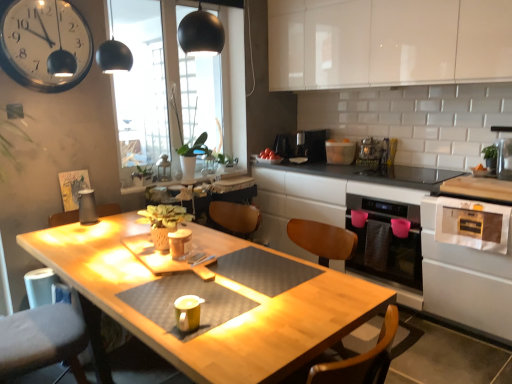
Describe the element at coordinates (503, 152) in the screenshot. I see `clear glass vase at upper right, the 4th appliance viewed from the front` at that location.

What do you see at coordinates (466, 280) in the screenshot? The height and width of the screenshot is (384, 512). I see `white glossy oven at lower right, the 1th oven in the front-to-back sequence` at bounding box center [466, 280].

Locate an element on the screen. This screenshot has height=384, width=512. matte plastic container at center, which is the 7th appliance in right-to-left order is located at coordinates (180, 243).

From the image's perspective, which is above, gray fabric swivel chair at lower left or white glossy countertop at center?

white glossy countertop at center appears higher in the image.

Does point (77, 360) lie in front of point (415, 303)?

Yes.

Is gray fabric swivel chair at lower left far away from white glossy countertop at center?

gray fabric swivel chair at lower left is positioned a significant distance from white glossy countertop at center.

Considering the sizes of gray fabric swivel chair at lower left and white glossy countertop at center in the image, is gray fabric swivel chair at lower left taller or shorter than white glossy countertop at center?

In the image, gray fabric swivel chair at lower left appears to be shorter than white glossy countertop at center.

Can you tell me how much white glossy clock at upper left and black glossy oven at lower right, arranged as the 2th oven when viewed from the front, differ in facing direction?

91.8 degrees separate the facing orientations of white glossy clock at upper left and black glossy oven at lower right, arranged as the 2th oven when viewed from the front.

Which is in front, white glossy clock at upper left or black glossy oven at lower right, arranged as the 2th oven when viewed from the front?

Positioned in front is white glossy clock at upper left.

From the image's perspective, is white glossy clock at upper left located above or below black glossy oven at lower right, arranged as the 2th oven when viewed from the front?

From the image's perspective, white glossy clock at upper left appears above black glossy oven at lower right, arranged as the 2th oven when viewed from the front.

Could you tell me if white glossy clock at upper left is facing black glossy oven at lower right, arranged as the 2th oven when viewed from the front?

No, white glossy clock at upper left does not turn towards black glossy oven at lower right, arranged as the 2th oven when viewed from the front.

Is white glossy clock at upper left placed right next to matte yellow cup at center, the eighth appliance positioned from the back?

No, white glossy clock at upper left is not with matte yellow cup at center, the eighth appliance positioned from the back.

Is white glossy clock at upper left thinner than matte yellow cup at center, the eighth appliance positioned from the back?

Correct, the width of white glossy clock at upper left is less than that of matte yellow cup at center, the eighth appliance positioned from the back.

Considering the sizes of white glossy clock at upper left and matte yellow cup at center, placed as the first appliance when sorted from front to back, in the image, is white glossy clock at upper left bigger or smaller than matte yellow cup at center, placed as the first appliance when sorted from front to back,?

In the image, white glossy clock at upper left appears to be larger than matte yellow cup at center, placed as the first appliance when sorted from front to back.

Is white glossy oven at lower right, placed as the 2th oven when sorted from back to front, turned away from white glossy clock at upper left?

That's not correct — white glossy oven at lower right, placed as the 2th oven when sorted from back to front, is not looking away from white glossy clock at upper left.

Looking at this image, can you tell me how much white glossy oven at lower right, placed as the 2th oven when sorted from back to front, and white glossy clock at upper left differ in facing direction?

The angular difference between white glossy oven at lower right, placed as the 2th oven when sorted from back to front, and white glossy clock at upper left is 91.8 degrees.

Which is correct: white glossy oven at lower right, placed as the 2th oven when sorted from back to front, is inside white glossy clock at upper left, or outside of it?

white glossy oven at lower right, placed as the 2th oven when sorted from back to front, is not inside white glossy clock at upper left, it's outside.

From a real-world perspective, is white glossy oven at lower right, placed as the 2th oven when sorted from back to front, on top of white glossy clock at upper left?

Incorrect, from a real-world perspective, white glossy oven at lower right, placed as the 2th oven when sorted from back to front, is lower than white glossy clock at upper left.

Who is shorter, white glossy cabinet at upper center or black glossy oven at lower right, which is the first oven from back to front?

black glossy oven at lower right, which is the first oven from back to front.

Which is behind, point (474, 46) or point (354, 230)?

The point (354, 230) is farther.

Is black glossy oven at lower right, arranged as the 2th oven when viewed from the front, a part of white glossy cabinet at upper center?

No.

Is white glossy cabinet at upper center directly adjacent to black glossy oven at lower right, which is the first oven from back to front?

white glossy cabinet at upper center and black glossy oven at lower right, which is the first oven from back to front, are clearly separated.

From a real-world perspective, relative to white glossy clock at upper left, is gray fabric swivel chair at lower left vertically above or below?

Clearly, from a real-world perspective, gray fabric swivel chair at lower left is below white glossy clock at upper left.

Is gray fabric swivel chair at lower left next to white glossy clock at upper left and touching it?

No, gray fabric swivel chair at lower left is not with white glossy clock at upper left.

Considering the relative sizes of gray fabric swivel chair at lower left and white glossy clock at upper left in the image provided, is gray fabric swivel chair at lower left thinner than white glossy clock at upper left?

In fact, gray fabric swivel chair at lower left might be wider than white glossy clock at upper left.

Does gray fabric swivel chair at lower left turn towards white glossy clock at upper left?

No, gray fabric swivel chair at lower left does not turn towards white glossy clock at upper left.

How different are the orientations of clear glass vase at upper right, which is the 1th appliance in right-to-left order, and green matte plant at center in degrees?

The angle between the facing direction of clear glass vase at upper right, which is the 1th appliance in right-to-left order, and the facing direction of green matte plant at center is 94.3 degrees.

From the image's perspective, between clear glass vase at upper right, the 4th appliance viewed from the front, and green matte plant at center, who is located below?

clear glass vase at upper right, the 4th appliance viewed from the front.

Between point (500, 129) and point (195, 157), which one is positioned behind?

The point (195, 157) is farther from the camera.

This screenshot has width=512, height=384. Find the location of `swivel chair on the left of white glossy countertop at center`. swivel chair on the left of white glossy countertop at center is located at coordinates (42, 340).

Find the location of a particular element. This screenshot has width=512, height=384. the 1st oven to the right when counting from the white glossy clock at upper left is located at coordinates (387, 247).

Estimate the real-world distances between objects in this image. Which object is closer to matte yellow cup at center, which ranks as the 3th appliance in left-to-right order, transparent glass window at upper center or white glossy clock at upper left?

white glossy clock at upper left is positioned closer to the anchor matte yellow cup at center, which ranks as the 3th appliance in left-to-right order.

When comparing their distances from gray fabric swivel chair at lower left, does white glossy countertop at center or white glossy cabinet at upper center seem closer?

The object closer to gray fabric swivel chair at lower left is white glossy countertop at center.

When comparing their distances from gray fabric swivel chair at lower left, does white glossy toaster at upper center, arranged as the sixth appliance when viewed from the front, or black plastic coffee maker at center, which is the 1th appliance from back to front, seem closer?

black plastic coffee maker at center, which is the 1th appliance from back to front.

Estimate the real-world distances between objects in this image. Which object is closer to white glossy cabinet at upper center, green matte plant at center or white glossy countertop at center?

Based on the image, white glossy countertop at center appears to be nearer to white glossy cabinet at upper center.

Which object lies nearer to the anchor point matte plastic container at center, which appears as the 2th appliance when viewed from the left, white glossy countertop at center or white glossy toaster at upper center, marked as the 3th appliance in a back-to-front arrangement?

white glossy countertop at center.

Which object lies further to the anchor point black glossy oven at lower right, which is the first oven from back to front, matte yellow cup at center, placed as the first appliance when sorted from front to back, or clear glass vase at upper right, positioned as the 8th appliance in left-to-right order?

Based on the image, matte yellow cup at center, placed as the first appliance when sorted from front to back, appears to be further to black glossy oven at lower right, which is the first oven from back to front.

Looking at the image, which one is located further to matte yellow cup at center, which ranks as the 3th appliance in left-to-right order, green matte plant at center or white glossy oven at lower right, the 1th oven in the front-to-back sequence?

Based on the image, green matte plant at center appears to be further to matte yellow cup at center, which ranks as the 3th appliance in left-to-right order.

From the image, which object appears to be nearer to white glossy cabinet at upper center, black plastic coffee maker at upper center, the 2th appliance in the back-to-front sequence, or green matte plant at center?

Among the two, black plastic coffee maker at upper center, the 2th appliance in the back-to-front sequence, is located nearer to white glossy cabinet at upper center.

Where is `plant located between gray fabric swivel chair at lower left and black plastic coffee maker at upper center, the fourth appliance when ordered from right to left, in the depth direction`? The image size is (512, 384). plant located between gray fabric swivel chair at lower left and black plastic coffee maker at upper center, the fourth appliance when ordered from right to left, in the depth direction is located at coordinates pos(176,111).

Where is `countertop between green matte plant at center and black glossy oven at lower right, arranged as the 2th oven when viewed from the front, in the horizontal direction`? The width and height of the screenshot is (512, 384). countertop between green matte plant at center and black glossy oven at lower right, arranged as the 2th oven when viewed from the front, in the horizontal direction is located at coordinates (422, 247).

You are a GUI agent. You are given a task and a screenshot of the screen. Output one action in this format:
    pyautogui.click(x=<x>, y=<y>)
    Task: Click on the clock between matte plastic container at center, which ranks as the second appliance in front-to-back order, and black plastic coffee maker at upper center, the 2th appliance in the back-to-front sequence, along the z-axis
    Image resolution: width=512 pixels, height=384 pixels.
    Given the screenshot: What is the action you would take?
    pyautogui.click(x=42, y=42)

The width and height of the screenshot is (512, 384). Find the location of `plant positioned between matte plastic container at center, which is the 7th appliance in right-to-left order, and black plastic coffee maker at center, the 8th appliance when ordered from front to back, from near to far`. plant positioned between matte plastic container at center, which is the 7th appliance in right-to-left order, and black plastic coffee maker at center, the 8th appliance when ordered from front to back, from near to far is located at coordinates (176, 111).